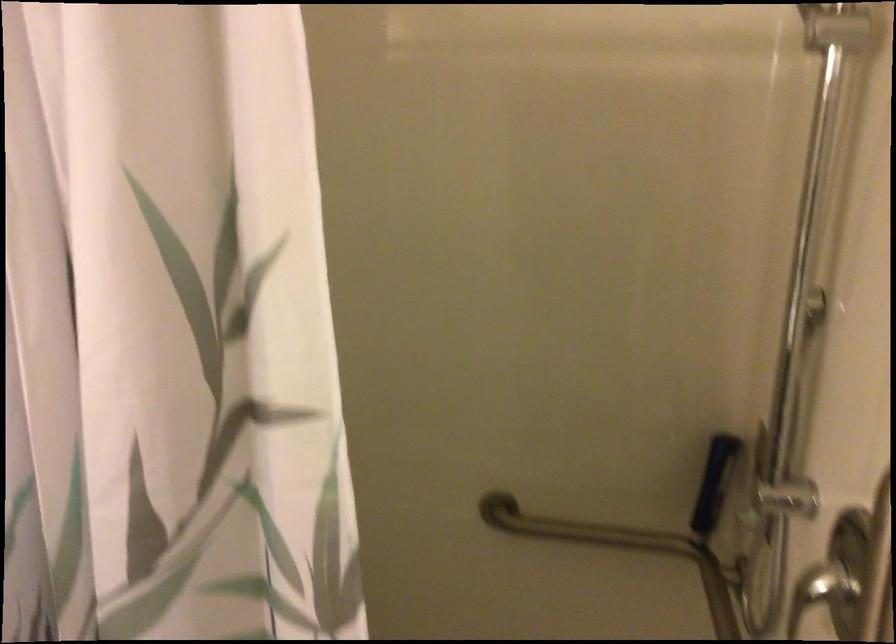
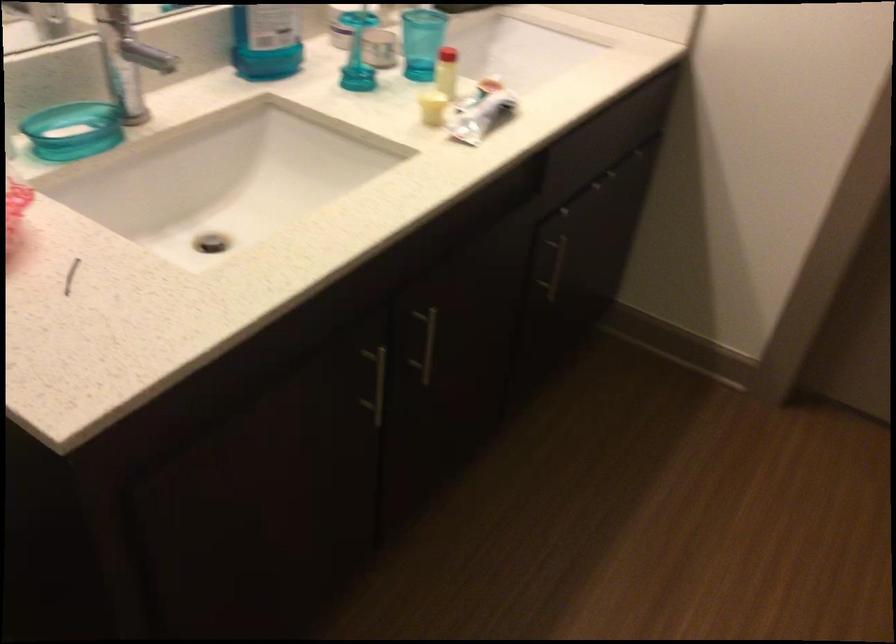
How did the camera likely rotate?

The camera rotated toward left-down.